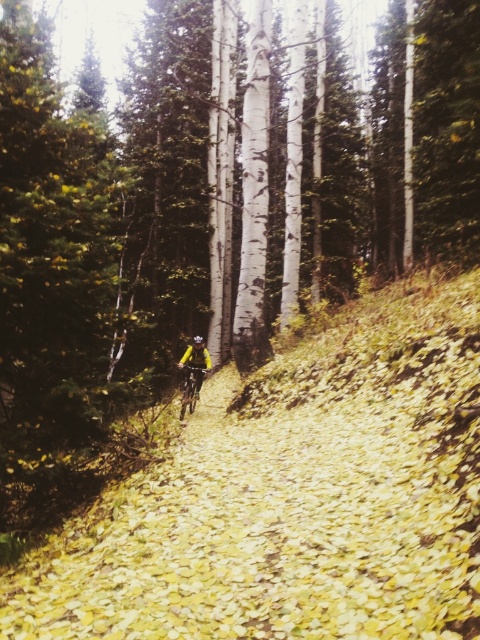
Based on the photo, you are a photographer aiming to capture the cyclist in the scene. You want to ensure both the yellow fabric jacket at center and the yellow matte helmet at center are clearly visible. Which object should you focus on first to ensure depth of field captures both?

The yellow fabric jacket at center is taller than the yellow matte helmet at center. To ensure both are in focus, focus on the yellow fabric jacket at center first since it is farther away, allowing the depth of field to cover the closer helmet.

You are a hiker who wants to take a photo of the yellow fabric jacket at center and the yellow matte bicycle at center. Which object should you focus on first to ensure both are in the frame?

You should focus on the yellow fabric jacket at center first because it is closer to you than the yellow matte bicycle at center, ensuring both are in the frame.